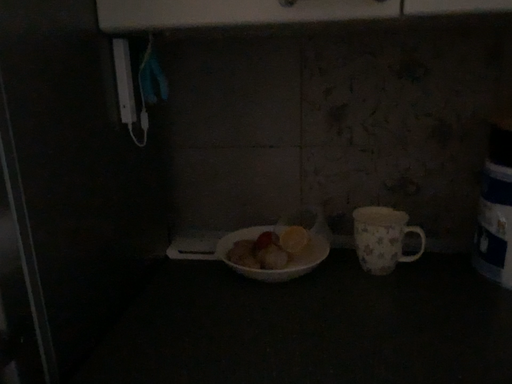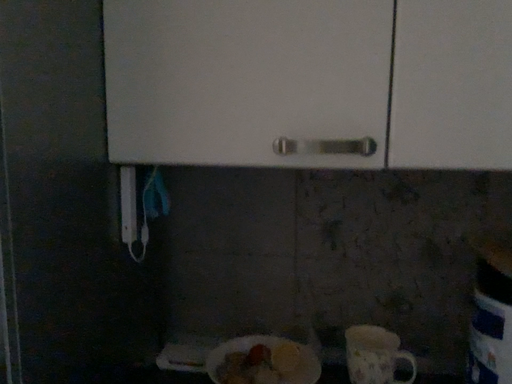
Question: Which way did the camera rotate in the video?

Choices:
 (A) rotated downward
 (B) rotated upward

Answer: (B)